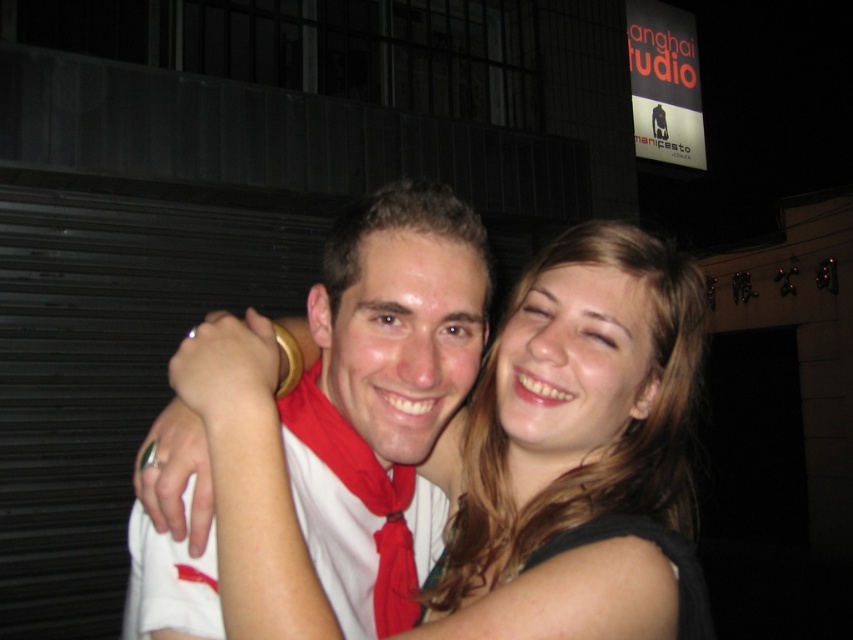
Which is behind, point (682, 349) or point (404, 598)?

The point (404, 598) is more distant.

Is point (619, 234) behind point (286, 436)?

No.

The image size is (853, 640). What do you see at coordinates (578, 454) in the screenshot?
I see `blonde hair at center` at bounding box center [578, 454].

You are a GUI agent. You are given a task and a screenshot of the screen. Output one action in this format:
    pyautogui.click(x=<x>, y=<y>)
    Task: Click on the blonde hair at center
    This screenshot has height=640, width=853.
    Given the screenshot: What is the action you would take?
    pyautogui.click(x=578, y=454)